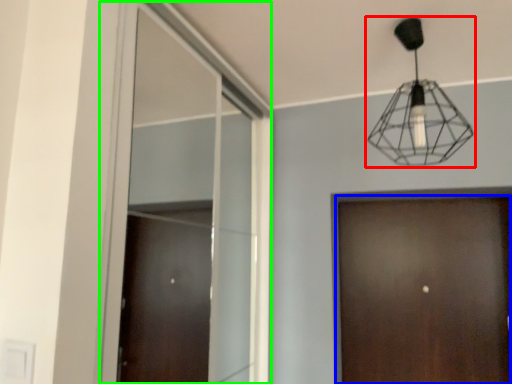
Question: Which object is positioned closest to lamp (highlighted by a red box)? Select from door (highlighted by a blue box) and window (highlighted by a green box).

Choices:
 (A) door
 (B) window

Answer: (A)